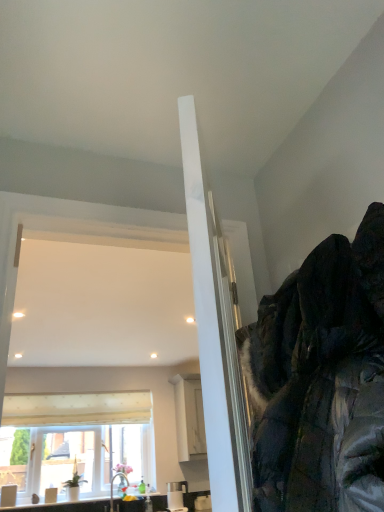
Find the location of a particular element. The image size is (384, 512). dark green textured jacket at upper right is located at coordinates (321, 380).

Find the location of `dark green textured jacket at upper right`. dark green textured jacket at upper right is located at coordinates (321, 380).

From the image's perspective, who appears lower, matte white sink at lower left, which is counted as the 2th sink, starting from the left, or white glossy sink at lower left, the second sink positioned from the right?

white glossy sink at lower left, the second sink positioned from the right, from the image's perspective.

Does point (112, 486) come in front of point (81, 502)?

That is False.

Is matte white sink at lower left, acting as the first sink starting from the right, completely or partially outside of white glossy sink at lower left, the second sink positioned from the right?

matte white sink at lower left, acting as the first sink starting from the right, lies outside white glossy sink at lower left, the second sink positioned from the right,'s area.

From a real-world perspective, is matte white sink at lower left, which is counted as the 2th sink, starting from the left, over white glossy sink at lower left, the second sink positioned from the right?

Indeed, from a real-world perspective, matte white sink at lower left, which is counted as the 2th sink, starting from the left, stands above white glossy sink at lower left, the second sink positioned from the right.

Between white glossy sink at lower left, the second sink positioned from the right, and matte white sink at lower left, which is counted as the 2th sink, starting from the left, which one appears on the left side from the viewer's perspective?

Positioned to the left is white glossy sink at lower left, the second sink positioned from the right.

In the scene shown: Between white glossy sink at lower left, the second sink positioned from the right, and matte white sink at lower left, which is counted as the 2th sink, starting from the left, which one has more height?

With more height is matte white sink at lower left, which is counted as the 2th sink, starting from the left.

From a real-world perspective, which is physically below, white glossy sink at lower left, the 1th sink from the left, or matte white sink at lower left, acting as the first sink starting from the right?

From a 3D spatial view, white glossy sink at lower left, the 1th sink from the left, is below.

You are a GUI agent. You are given a task and a screenshot of the screen. Output one action in this format:
    pyautogui.click(x=<x>, y=<y>)
    Task: Click on the sink above the white glossy sink at lower left, the second sink positioned from the right (from the image's perspective)
    Image resolution: width=384 pixels, height=512 pixels.
    Given the screenshot: What is the action you would take?
    pyautogui.click(x=112, y=487)

Considering the sizes of objects white textured curtain at lower left and matte white sink at lower left, acting as the first sink starting from the right, in the image provided, who is taller, white textured curtain at lower left or matte white sink at lower left, acting as the first sink starting from the right,?

With more height is matte white sink at lower left, acting as the first sink starting from the right.

Which point is more forward, [117,423] or [127,481]?

The point [127,481] is closer.

Who is smaller, white textured curtain at lower left or matte white sink at lower left, acting as the first sink starting from the right?

With smaller size is matte white sink at lower left, acting as the first sink starting from the right.

In terms of size, does dark green textured jacket at upper right appear bigger or smaller than white textured window at center?

In the image, dark green textured jacket at upper right appears to be smaller than white textured window at center.

Is dark green textured jacket at upper right to the left or to the right of white textured window at center in the image?

Clearly, dark green textured jacket at upper right is on the right of white textured window at center in the image.

How different are the orientations of dark green textured jacket at upper right and white textured window at center in degrees?

They differ by 88.6 degrees in their facing directions.

Does dark green textured jacket at upper right have a greater width compared to white textured window at center?

Yes.

Considering the positions of objects matte white sink at lower left, which is counted as the 2th sink, starting from the left, and white textured window at center in the image provided, who is more to the left, matte white sink at lower left, which is counted as the 2th sink, starting from the left, or white textured window at center?

From the viewer's perspective, white textured window at center appears more on the left side.

You are a GUI agent. You are given a task and a screenshot of the screen. Output one action in this format:
    pyautogui.click(x=<x>, y=<y>)
    Task: Click on the window above the matte white sink at lower left, which is counted as the 2th sink, starting from the left (from a real-world perspective)
    
    Given the screenshot: What is the action you would take?
    [76, 439]

In the scene shown: From the image's perspective, between matte white sink at lower left, which is counted as the 2th sink, starting from the left, and white textured window at center, which one is located above?

white textured window at center appears higher in the image.

Can you tell me how much matte white sink at lower left, which is counted as the 2th sink, starting from the left, and white textured window at center differ in facing direction?

The angular difference between matte white sink at lower left, which is counted as the 2th sink, starting from the left, and white textured window at center is 0.325 degrees.

Is white textured curtain at lower left taller than white textured window at center?

Incorrect, the height of white textured curtain at lower left is not larger of that of white textured window at center.

Is white textured curtain at lower left not near white textured window at center?

No, white textured curtain at lower left is in close proximity to white textured window at center.

Does white textured curtain at lower left appear on the left side of white textured window at center?

In fact, white textured curtain at lower left is to the right of white textured window at center.

Between white textured curtain at lower left and white textured window at center, which one is positioned in front?

white textured window at center.

Considering the sizes of objects dark green textured jacket at upper right and white textured curtain at lower left in the image provided, who is taller, dark green textured jacket at upper right or white textured curtain at lower left?

dark green textured jacket at upper right.

In the scene shown: Is the depth of dark green textured jacket at upper right less than that of white textured curtain at lower left?

Yes, dark green textured jacket at upper right is closer to the camera.

Is dark green textured jacket at upper right far away from white textured curtain at lower left?

Yes, dark green textured jacket at upper right and white textured curtain at lower left are located far from each other.

In the image, there is a white glossy sink at lower left, the 1th sink from the left. In order to click on sink above it (from the image's perspective) in this screenshot , I will do `click(112, 487)`.

Where is `sink that is under the matte white sink at lower left, which is counted as the 2th sink, starting from the left (from a real-world perspective)`? sink that is under the matte white sink at lower left, which is counted as the 2th sink, starting from the left (from a real-world perspective) is located at coordinates (65, 507).

Considering their positions, is dark green textured jacket at upper right positioned closer to matte white sink at lower left, acting as the first sink starting from the right, than white textured window at center?

white textured window at center.

From the image, which object appears to be farther from white textured curtain at lower left, white textured window at center or dark green textured jacket at upper right?

dark green textured jacket at upper right is positioned further to the anchor white textured curtain at lower left.

Based on their spatial positions, is matte white sink at lower left, acting as the first sink starting from the right, or dark green textured jacket at upper right closer to white textured window at center?

Among the two, matte white sink at lower left, acting as the first sink starting from the right, is located nearer to white textured window at center.

Considering their positions, is white textured curtain at lower left positioned closer to dark green textured jacket at upper right than white glossy sink at lower left, the second sink positioned from the right?

Based on the image, white glossy sink at lower left, the second sink positioned from the right, appears to be nearer to dark green textured jacket at upper right.

Estimate the real-world distances between objects in this image. Which object is closer to white glossy sink at lower left, the second sink positioned from the right, white textured window at center or dark green textured jacket at upper right?

white textured window at center lies closer to white glossy sink at lower left, the second sink positioned from the right, than the other object.

Considering their positions, is white glossy sink at lower left, the second sink positioned from the right, positioned closer to white textured window at center than dark green textured jacket at upper right?

white glossy sink at lower left, the second sink positioned from the right, is closer to white textured window at center.

Considering their positions, is white textured window at center positioned further to matte white sink at lower left, acting as the first sink starting from the right, than white glossy sink at lower left, the second sink positioned from the right?

Based on the image, white textured window at center appears to be further to matte white sink at lower left, acting as the first sink starting from the right.

Considering their positions, is white textured curtain at lower left positioned closer to dark green textured jacket at upper right than white textured window at center?

white textured window at center is positioned closer to the anchor dark green textured jacket at upper right.

Locate an element on the screen. The image size is (384, 512). sink between dark green textured jacket at upper right and white glossy sink at lower left, the second sink positioned from the right, in the front-back direction is located at coordinates (112, 487).

You are a GUI agent. You are given a task and a screenshot of the screen. Output one action in this format:
    pyautogui.click(x=<x>, y=<y>)
    Task: Click on the sink between white textured curtain at lower left and white glossy sink at lower left, the 1th sink from the left, in the vertical direction
    
    Given the screenshot: What is the action you would take?
    pyautogui.click(x=112, y=487)

Where is `sink between white textured window at center and matte white sink at lower left, acting as the first sink starting from the right`? The height and width of the screenshot is (512, 384). sink between white textured window at center and matte white sink at lower left, acting as the first sink starting from the right is located at coordinates (65, 507).

What are the coordinates of `window between white textured curtain at lower left and matte white sink at lower left, acting as the first sink starting from the right, vertically` in the screenshot? It's located at (76, 439).